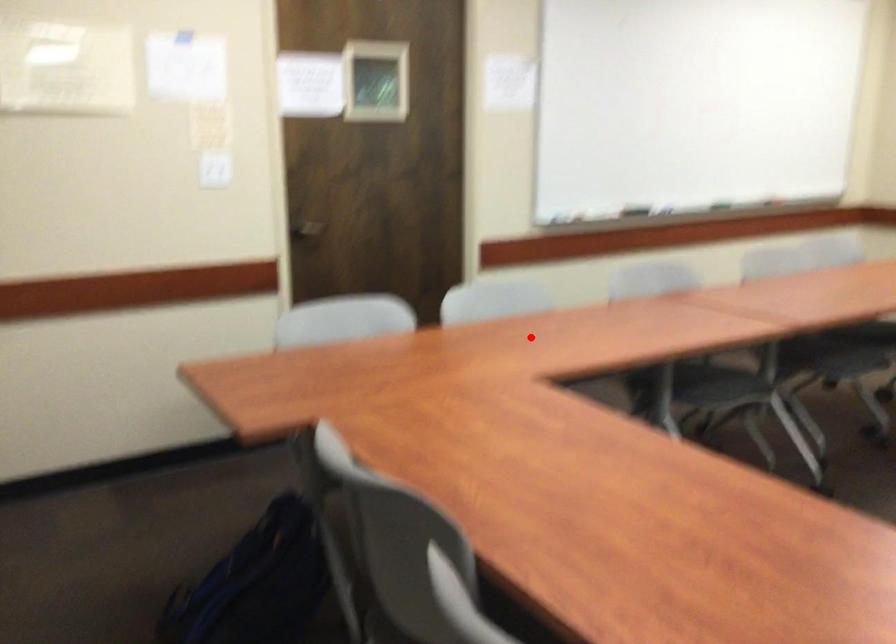
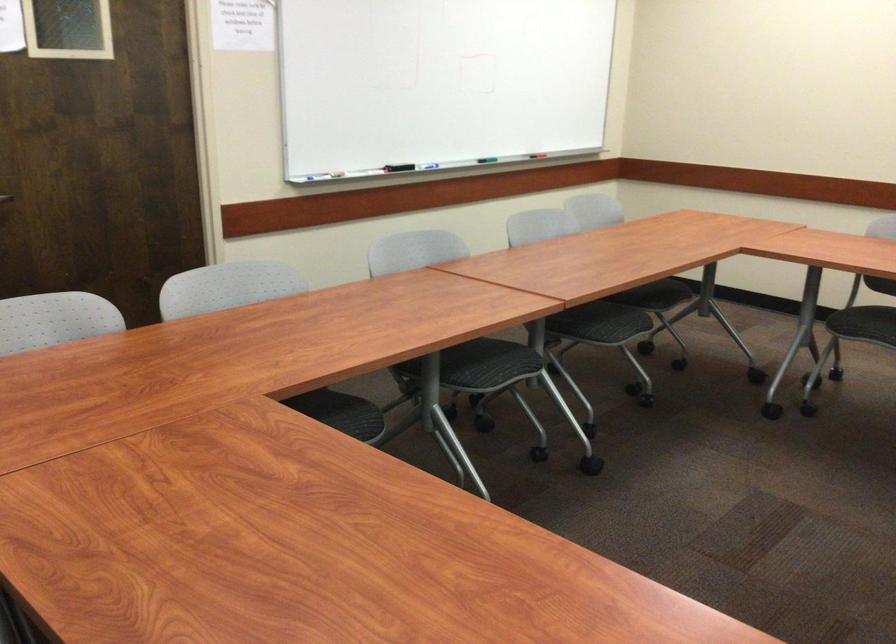
Question: I am providing you with two images of the same scene from different viewpoints. A red point is marked on the first image. Can you still see the location of the red point in image 2?

Choices:
 (A) Yes
 (B) No

Answer: (A)